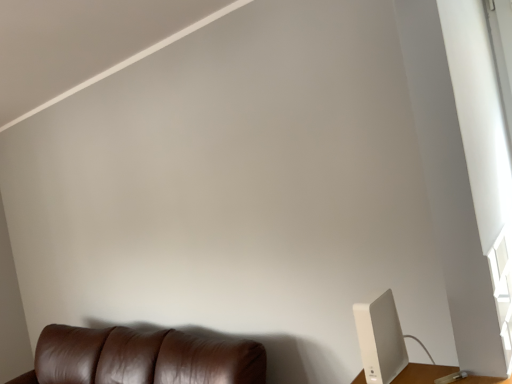
Question: Would you say white plastic router at lower right is to the left or to the right of brown leather couch at lower left in the picture?

Choices:
 (A) left
 (B) right

Answer: (B)

Question: Is white plastic router at lower right in front of or behind brown leather couch at lower left in the image?

Choices:
 (A) behind
 (B) front

Answer: (B)

Question: Considering the positions of point (376, 301) and point (117, 357), is point (376, 301) closer or farther from the camera than point (117, 357)?

Choices:
 (A) closer
 (B) farther

Answer: (A)

Question: From a real-world perspective, is brown leather couch at lower left positioned above or below white plastic router at lower right?

Choices:
 (A) above
 (B) below

Answer: (B)

Question: Is brown leather couch at lower left situated inside white plastic router at lower right or outside?

Choices:
 (A) inside
 (B) outside

Answer: (B)

Question: Considering the positions of brown leather couch at lower left and white plastic router at lower right in the image, is brown leather couch at lower left taller or shorter than white plastic router at lower right?

Choices:
 (A) tall
 (B) short

Answer: (A)

Question: In terms of size, does brown leather couch at lower left appear bigger or smaller than white plastic router at lower right?

Choices:
 (A) small
 (B) big

Answer: (B)